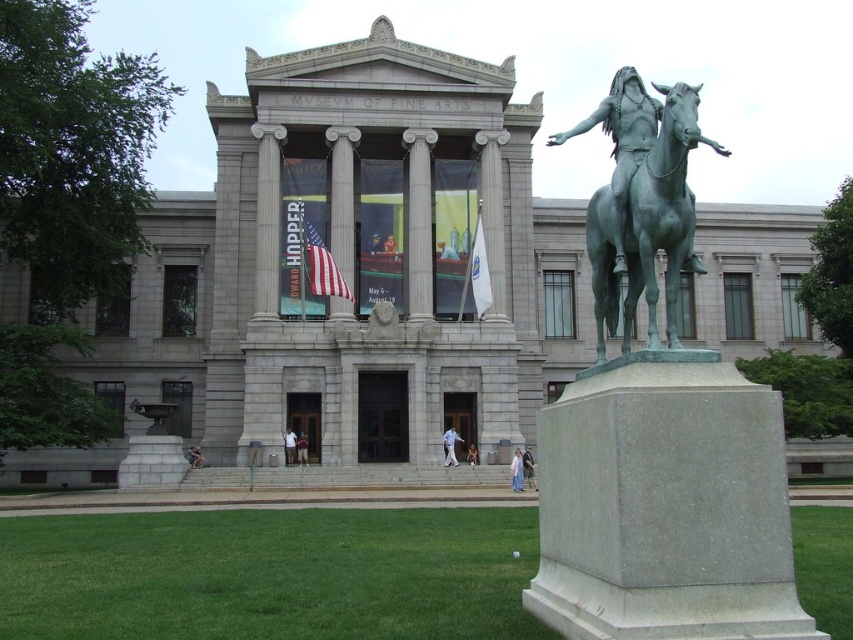
Question: Which of the following is the farthest from the observer?

Choices:
 (A) tap(654, 188)
 (B) tap(520, 467)
 (C) tap(479, 209)
 (D) tap(527, 451)

Answer: (C)

Question: Is american flag at center smaller than white fabric flag at center?

Choices:
 (A) yes
 (B) no

Answer: (B)

Question: Which object appears closest to the camera in this image?

Choices:
 (A) green grass at lower center
 (B) american flag at center
 (C) pink fabric dress at lower center

Answer: (A)

Question: Where is green patina bronze statue at right located in relation to light blue jeans at center in the image?

Choices:
 (A) above
 (B) below

Answer: (A)

Question: Which of the following is the closest to the observer?

Choices:
 (A) green patina bronze statue at right
 (B) pink fabric dress at lower center
 (C) light brown wooden chair at center
 (D) light blue jeans at center

Answer: (A)

Question: Observing the image, what is the correct spatial positioning of american flag at center in reference to pink fabric dress at lower center?

Choices:
 (A) below
 (B) above

Answer: (B)